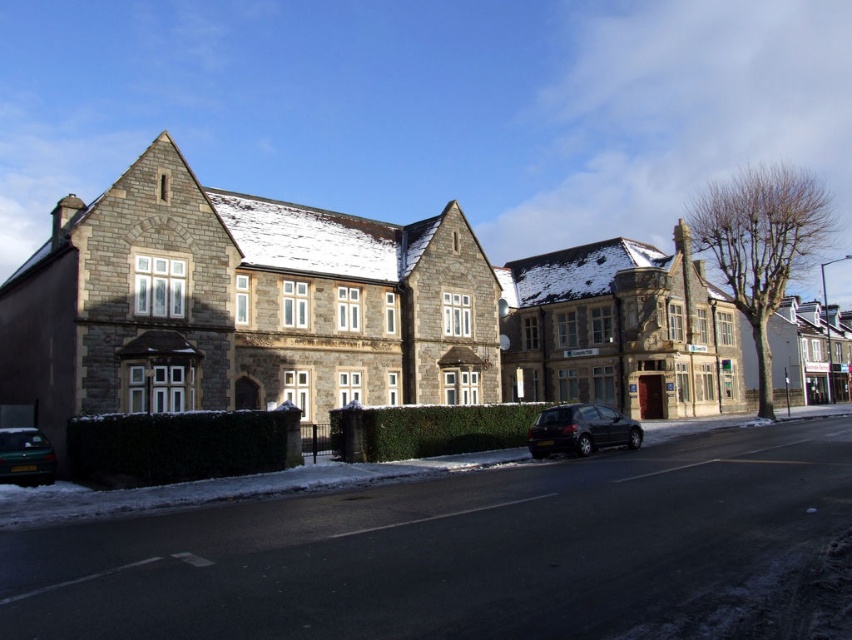
Question: Can you confirm if shiny black hatchback at center is wider than green matte car at lower left?

Choices:
 (A) no
 (B) yes

Answer: (B)

Question: Which point appears farthest from the camera in this image?

Choices:
 (A) (20, 444)
 (B) (616, 435)

Answer: (B)

Question: Is shiny black hatchback at center wider than green matte car at lower left?

Choices:
 (A) no
 (B) yes

Answer: (B)

Question: Which point appears farthest from the camera in this image?

Choices:
 (A) (27, 465)
 (B) (571, 428)

Answer: (B)

Question: Is shiny black hatchback at center to the left of green matte car at lower left from the viewer's perspective?

Choices:
 (A) no
 (B) yes

Answer: (A)

Question: Which of the following is the farthest from the observer?

Choices:
 (A) (7, 428)
 (B) (607, 406)

Answer: (B)